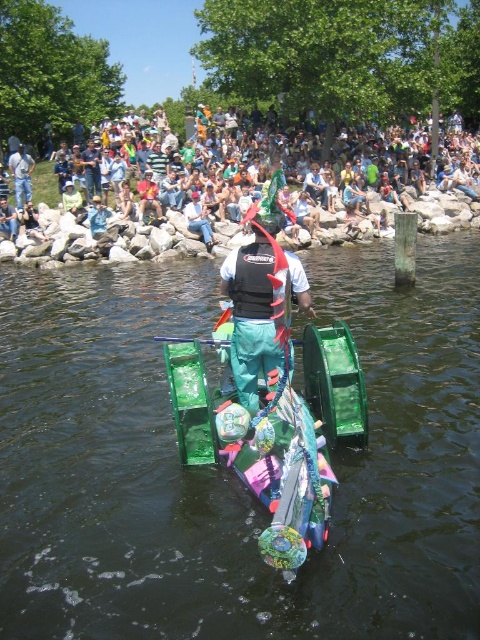
Question: Does green plastic boat at center appear over black life vest at center?

Choices:
 (A) yes
 (B) no

Answer: (B)

Question: Considering the relative positions of green plastic boat at center and black life vest at center in the image provided, where is green plastic boat at center located with respect to black life vest at center?

Choices:
 (A) below
 (B) above

Answer: (A)

Question: Which point is closer to the camera?

Choices:
 (A) light blue fabric shirt at center
 (B) black life vest at center
 (C) multicolored fabric crowd at upper center

Answer: (B)

Question: Is the position of green plastic boat at center less distant than that of shiny green plastic boat at center?

Choices:
 (A) no
 (B) yes

Answer: (A)

Question: Which point is farther from the camera taking this photo?

Choices:
 (A) (225, 492)
 (B) (39, 228)

Answer: (B)

Question: Among these objects, which one is farthest from the camera?

Choices:
 (A) light blue fabric shirt at center
 (B) black life vest at center
 (C) green plastic boat at center
 (D) shiny green plastic boat at center

Answer: (A)